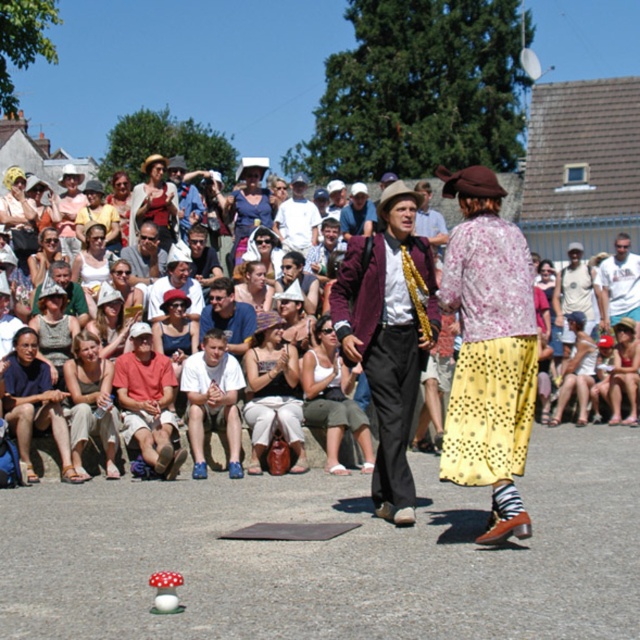
Who is positioned more to the right, maroon velvet jacket at center or white cotton t-shirt at center?

white cotton t-shirt at center

Looking at this image, which is more to the left, maroon velvet jacket at center or white cotton t-shirt at center?

maroon velvet jacket at center is more to the left.

Is point (384, 269) more distant than point (612, 308)?

No, it is in front of (612, 308).

I want to click on maroon velvet jacket at center, so tap(388, 336).

Is white cotton tank top at center above blue denim jeans at lower left?

Yes.

This screenshot has width=640, height=640. I want to click on white cotton tank top at center, so click(x=332, y=397).

Find the location of `white cotton tank top at center`. white cotton tank top at center is located at coordinates (332, 397).

Does maroon velvet jacket at center have a smaller size compared to white cotton tank top at center?

Yes, maroon velvet jacket at center is smaller than white cotton tank top at center.

Who is more distant from viewer, (x=394, y=358) or (x=314, y=358)?

The point (x=314, y=358) is behind.

Describe the element at coordinates (388, 336) in the screenshot. I see `maroon velvet jacket at center` at that location.

Locate an element on the screen. This screenshot has height=640, width=640. maroon velvet jacket at center is located at coordinates (388, 336).